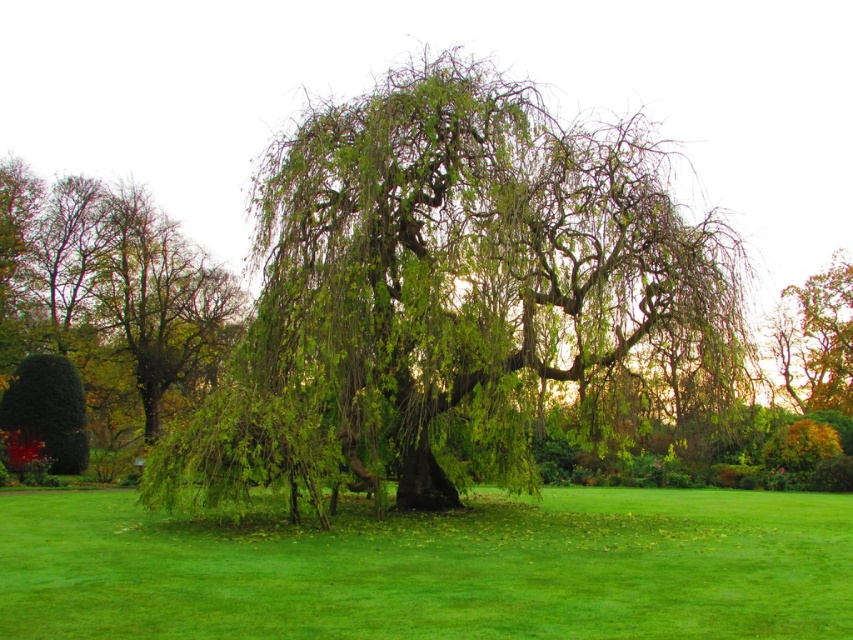
Who is positioned more to the right, green grass at center or green leafy tree at left?

green grass at center is more to the right.

Does green grass at center appear under green leafy tree at left?

Yes.

Who is more forward, (434,573) or (138,435)?

Point (434,573)

Image resolution: width=853 pixels, height=640 pixels. I want to click on green grass at center, so click(x=433, y=566).

Is green leafy willow at center wider than green leafy tree at upper right?

No.

At what (x,y) coordinates should I click in order to perform the action: click on green leafy willow at center. Please return your answer as a coordinate pair (x, y). Looking at the image, I should click on (448, 294).

Which is behind, point (39, 253) or point (770, 330)?

The point (770, 330) is more distant.

Does point (111, 432) come in front of point (775, 355)?

Yes, it is in front of point (775, 355).

The width and height of the screenshot is (853, 640). Find the location of `green leafy tree at left`. green leafy tree at left is located at coordinates (102, 314).